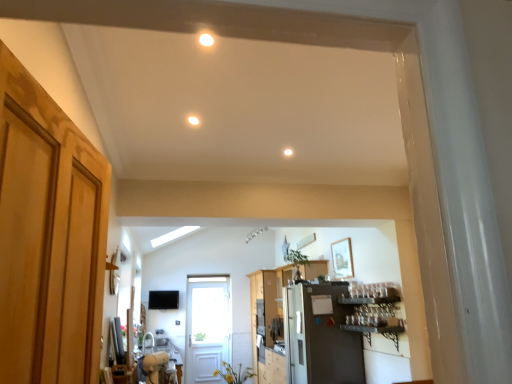
This screenshot has width=512, height=384. I want to click on vacant area that is in front of white matte light fixture at center, which is the first lighting in back-to-front order, so click(x=291, y=146).